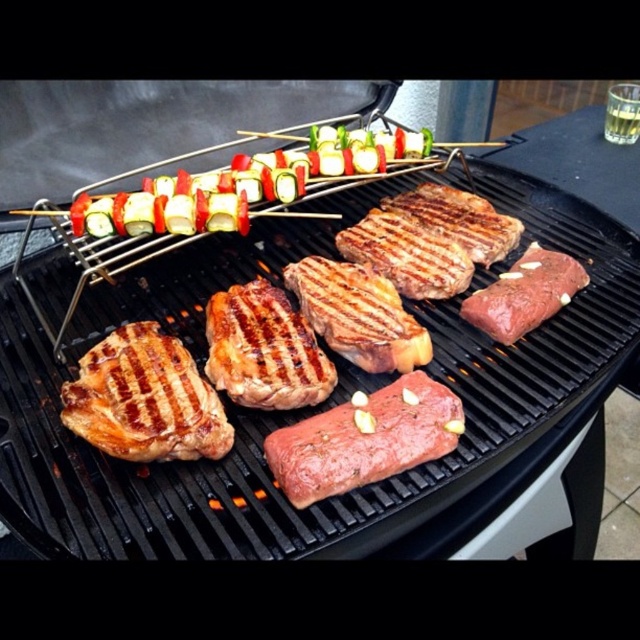
You are a chef preparing a steak dinner. You have a raw pink steak at center and a grilled brown steak at center on the grill. How far apart are these two steaks?

The distance between the raw pink steak at center and the grilled brown steak at center is 6.70 inches.